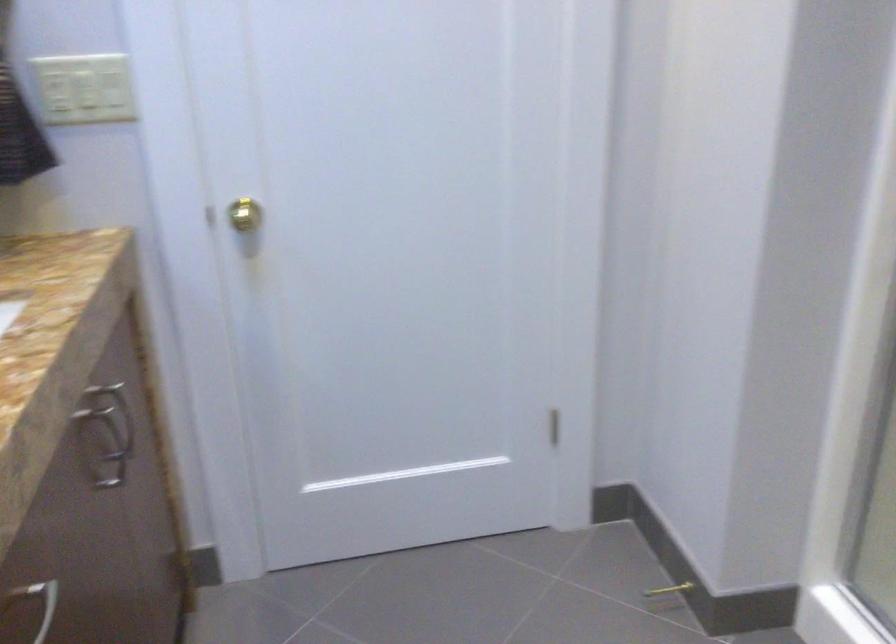
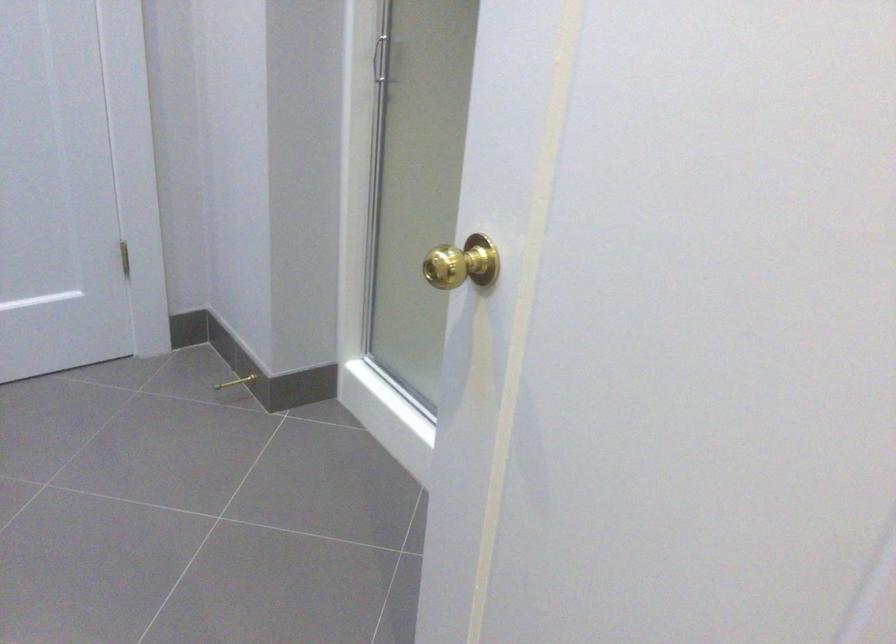
Question: In a continuous first-person perspective shot, in which direction is the camera moving?

Choices:
 (A) Left
 (B) Right
 (C) Forward
 (D) Backward

Answer: (D)